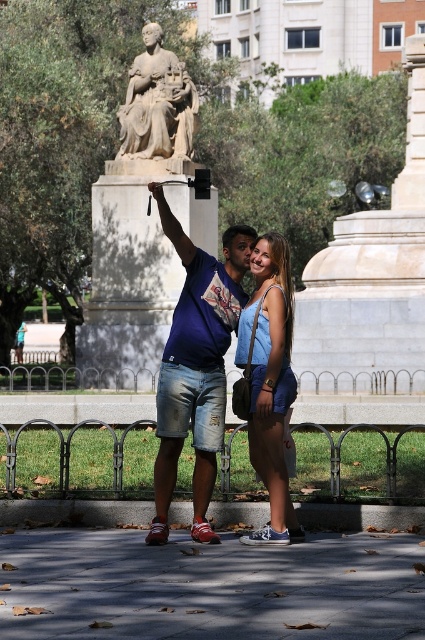
Question: Which object is the closest to the blue denim shorts at center?

Choices:
 (A) stone statue at upper center
 (B) denim shorts at center

Answer: (B)

Question: Among these objects, which one is farthest from the camera?

Choices:
 (A) stone statue at upper center
 (B) denim shorts at center

Answer: (A)

Question: Is denim shorts at center closer to camera compared to stone statue at upper center?

Choices:
 (A) yes
 (B) no

Answer: (A)

Question: Estimate the real-world distances between objects in this image. Which object is closer to the denim shorts at center?

Choices:
 (A) stone statue at upper center
 (B) blue denim shorts at center

Answer: (B)

Question: Is blue denim shorts at center thinner than stone statue at upper center?

Choices:
 (A) no
 (B) yes

Answer: (A)

Question: Can you confirm if blue denim shorts at center is smaller than stone statue at upper center?

Choices:
 (A) no
 (B) yes

Answer: (A)